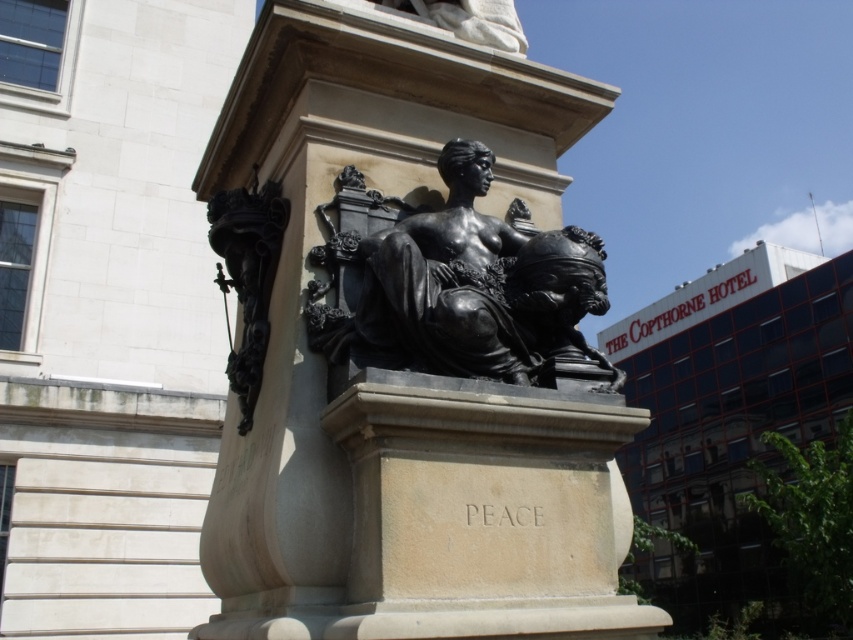
Question: Does bronze statue at center have a smaller size compared to black polished statue at center?

Choices:
 (A) no
 (B) yes

Answer: (B)

Question: Which point is farther to the camera?

Choices:
 (A) (482, 317)
 (B) (497, 522)

Answer: (A)

Question: Is bronze statue at center positioned at the back of black polished statue at center?

Choices:
 (A) yes
 (B) no

Answer: (B)

Question: Is bronze statue at center positioned at the back of black polished statue at center?

Choices:
 (A) yes
 (B) no

Answer: (B)